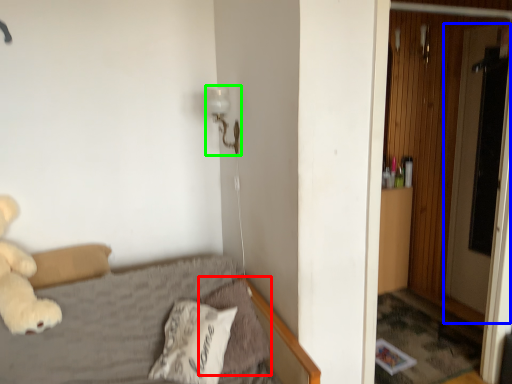
Question: Based on their relative distances, which object is nearer to pillow (highlighted by a red box)? Choose from screen door (highlighted by a blue box) and lamp (highlighted by a green box).

Choices:
 (A) screen door
 (B) lamp

Answer: (B)